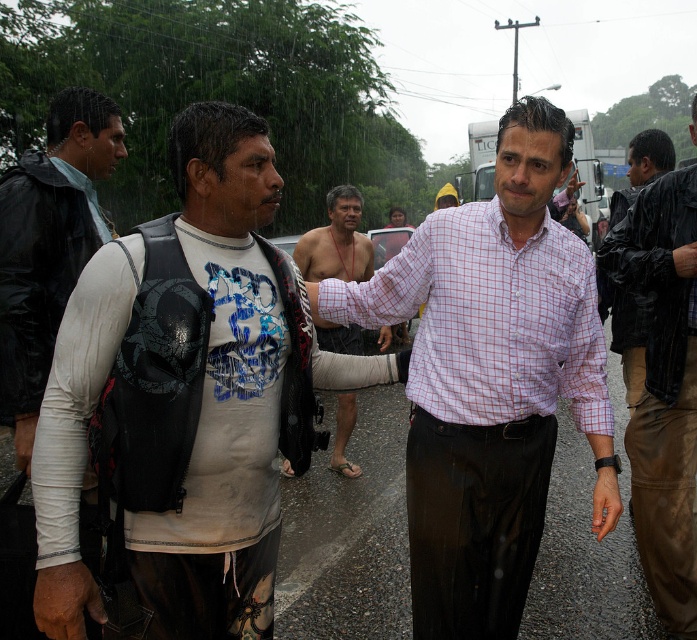
Question: In this image, where is white matte shirt at center located relative to shiny black wetsuit at center?

Choices:
 (A) right
 (B) left

Answer: (B)

Question: Which point appears farthest from the camera in this image?

Choices:
 (A) click(148, 573)
 (B) click(335, 460)

Answer: (B)

Question: Which object is farther from the camera taking this photo?

Choices:
 (A) black matte jacket at right
 (B) white matte shirt at center
 (C) white matte long-sleeve shirt at left
 (D) matte black jacket at center

Answer: (D)

Question: Which of the following is the farthest from the observer?

Choices:
 (A) (487, 461)
 (B) (597, 276)

Answer: (B)

Question: Can you confirm if plaid cotton shirt at center is wider than white matte shirt at center?

Choices:
 (A) no
 (B) yes

Answer: (B)

Question: Does shiny black wetsuit at center have a greater width compared to black matte jacket at right?

Choices:
 (A) yes
 (B) no

Answer: (B)